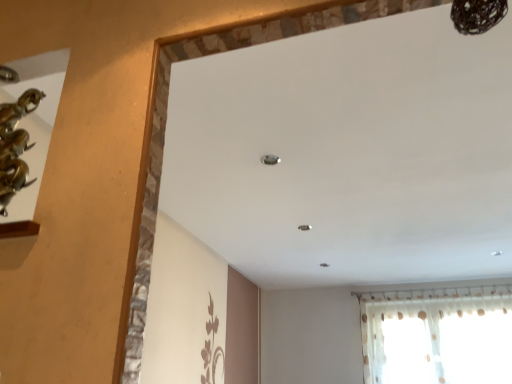
What is the approximate width of translucent fabric curtain at lower right?

translucent fabric curtain at lower right is 12.60 inches in width.

Where is `translucent fabric curtain at lower right`? This screenshot has width=512, height=384. translucent fabric curtain at lower right is located at coordinates (437, 335).

This screenshot has width=512, height=384. Describe the element at coordinates (437, 335) in the screenshot. I see `translucent fabric curtain at lower right` at that location.

This screenshot has height=384, width=512. Find the location of `translucent fabric curtain at lower right`. translucent fabric curtain at lower right is located at coordinates [x=437, y=335].